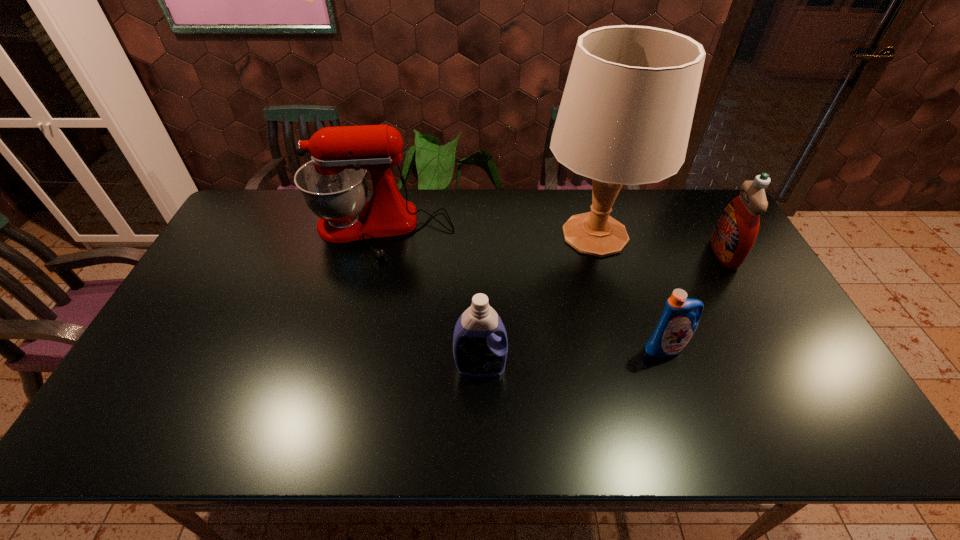
The image size is (960, 540). I want to click on blank space at the right edge, so click(780, 326).

This screenshot has height=540, width=960. I want to click on free space at the far left corner, so click(279, 189).

Identify the location of free region at the near left corner of the desktop. (144, 413).

Where is `free space that is in between the table lamp and the rightmost detergent`? free space that is in between the table lamp and the rightmost detergent is located at coordinates pyautogui.click(x=660, y=244).

Where is `vacant area that lies between the fourth object from right to left and the mixer`? vacant area that lies between the fourth object from right to left and the mixer is located at coordinates (430, 299).

This screenshot has width=960, height=540. What are the coordinates of `vacant point located between the tallest object and the leftmost detergent` in the screenshot? It's located at (538, 301).

You are a GUI agent. You are given a task and a screenshot of the screen. Output one action in this format:
    pyautogui.click(x=<x>, y=<y>)
    Task: Click on the empty space that is in between the leftmost detergent and the mixer
    
    Given the screenshot: What is the action you would take?
    pyautogui.click(x=430, y=299)

Where is `free spot between the leftmost object and the second detergent from left to right`? Image resolution: width=960 pixels, height=540 pixels. free spot between the leftmost object and the second detergent from left to right is located at coordinates (522, 289).

The height and width of the screenshot is (540, 960). Identify the location of free spot between the leftmost detergent and the shortest object. (573, 357).

Locate which object ranks in proximity to the rightmost detergent. Please provide its 2D coordinates. Your answer should be formatted as a tuple, i.e. [(x, y)], where the tuple contains the x and y coordinates of a point satisfying the conditions above.

[(625, 117)]